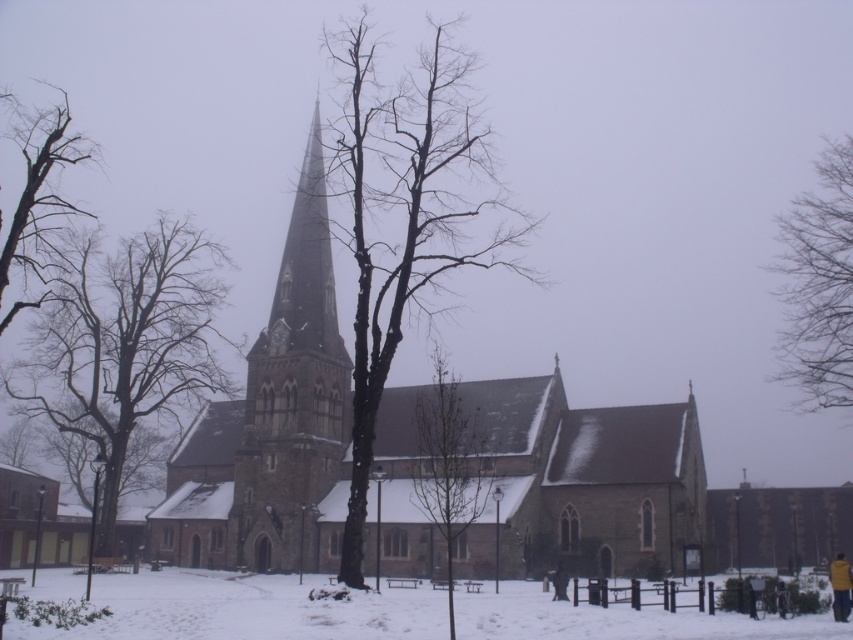
Which is above, bare wood tree at center or dark blue jacket at lower center?

bare wood tree at center is higher up.

Who is more forward, (x=431, y=474) or (x=554, y=582)?

Point (x=554, y=582)

Identify the location of bare wood tree at center. (450, 464).

In the scene shown: How much distance is there between smooth bark tree at center and dark gray stone tower at center?

The distance of smooth bark tree at center from dark gray stone tower at center is 15.28 meters.

Is point (422, 52) closer to camera compared to point (286, 253)?

That is False.

Which is in front, point (447, 168) or point (314, 216)?

Point (314, 216) is in front.

Image resolution: width=853 pixels, height=640 pixels. What are the coordinates of `smooth bark tree at center` in the screenshot? It's located at (405, 216).

Does dark brown bark tree at left have a lesser height compared to yellow fabric jacket at lower right?

Incorrect, dark brown bark tree at left's height does not fall short of yellow fabric jacket at lower right's.

Is dark brown bark tree at left bigger than yellow fabric jacket at lower right?

Yes.

Image resolution: width=853 pixels, height=640 pixels. Describe the element at coordinates (38, 198) in the screenshot. I see `dark brown bark tree at left` at that location.

Locate an element on the screen. The image size is (853, 640). dark brown bark tree at left is located at coordinates (38, 198).